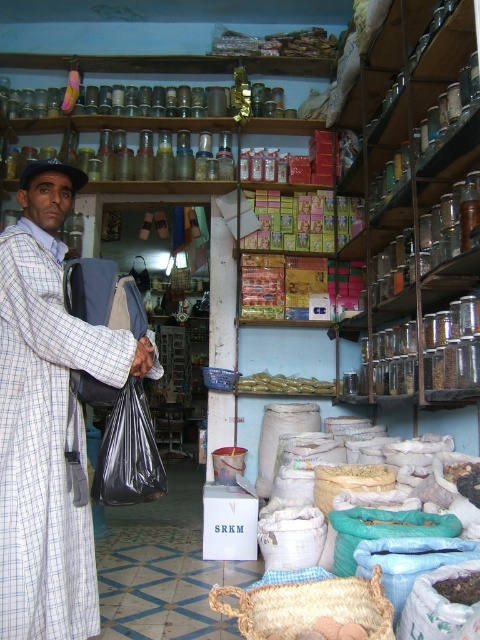
You are standing in the shop and need to reach the black plastic bag at left without moving the plaid fabric man at left. Is there enough space between them for your hand to fit?

The plaid fabric man at left is 25.92 centimeters away from the black plastic bag at left. Since an average hand is about 18 centimeters long, there is enough space for your hand to fit between them.